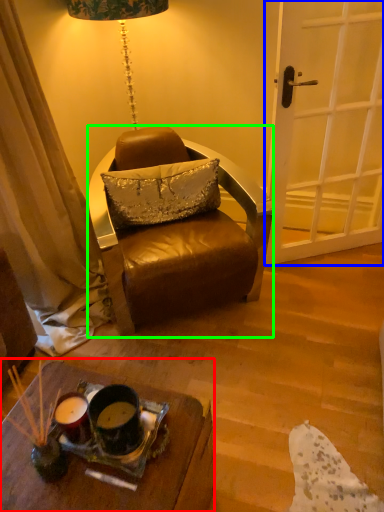
Question: Estimate the real-world distances between objects in this image. Which object is farther from desk (highlighted by a red box), door (highlighted by a blue box) or chair (highlighted by a green box)?

Choices:
 (A) door
 (B) chair

Answer: (A)